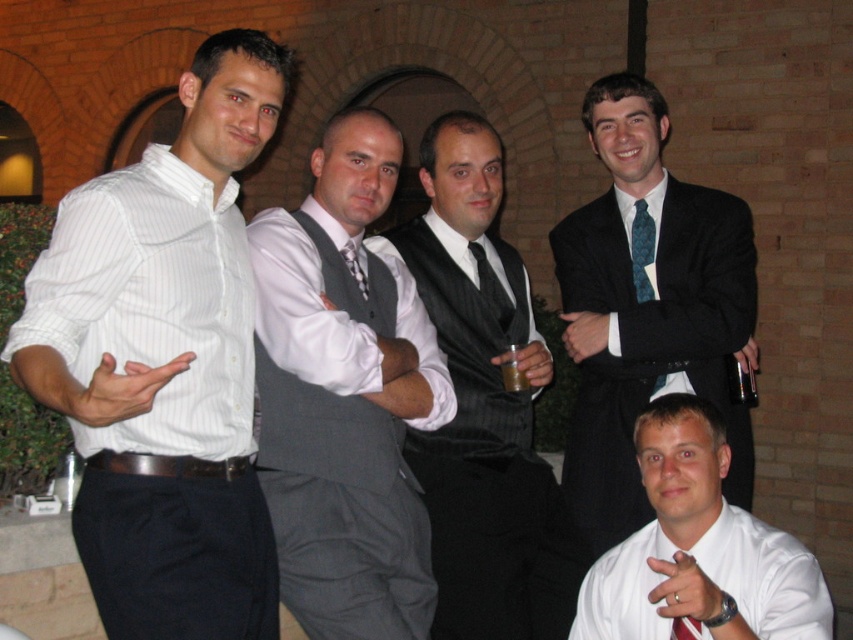
Does gray fabric vest at center have a lesser height compared to black textured tie at center?

No, gray fabric vest at center is not shorter than black textured tie at center.

Does gray fabric vest at center appear under black textured tie at center?

Yes, gray fabric vest at center is below black textured tie at center.

Between point (305, 278) and point (347, 252), which one is positioned behind?

Point (347, 252)

Find the location of `gray fabric vest at center`. gray fabric vest at center is located at coordinates pos(345,397).

Is gray fabric vest at center below white glossy shirt at center?

No.

Does point (321, 324) come farther from viewer compared to point (618, 561)?

No, it is in front of (618, 561).

Where is `gray fabric vest at center`? The width and height of the screenshot is (853, 640). gray fabric vest at center is located at coordinates (345, 397).

Is matte black vest at center smaller than white glossy shirt at center?

No.

Is matte black vest at center further to camera compared to white glossy shirt at center?

That is True.

Which is in front, point (474, 212) or point (718, 556)?

Point (718, 556)

This screenshot has height=640, width=853. Identify the location of matte black vest at center. (482, 406).